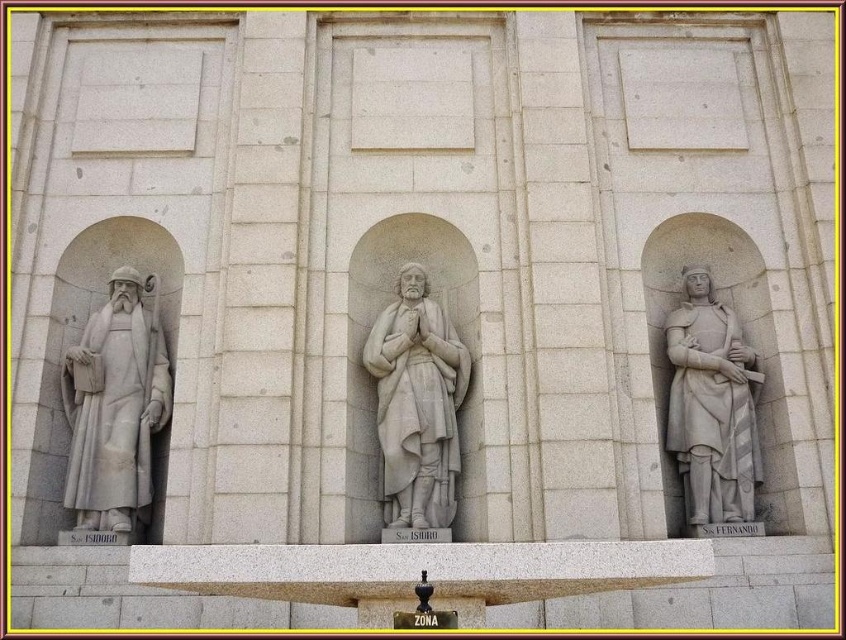
You are standing in front of a stone wall with two statues. The white marble statue at left and the white stone statue at right. Which statue is positioned more to the left side of the wall?

The white marble statue at left is positioned more to the left side of the wall compared to the white stone statue at right.

You are an art student analyzing the statues on the stone wall. You notice the white marble statue at left and the white stone statue at right. Which statue is positioned lower on the wall?

The white marble statue at left is positioned lower on the wall than the white stone statue at right.

You are standing in front of a stone wall with three statues. The white marble statue at center is positioned at a certain distance. If you want to take a closer look at the statue, would you need to move forward or backward?

The white marble statue at center is 44.98 meters away from the viewer, so you would need to move forward to get closer.